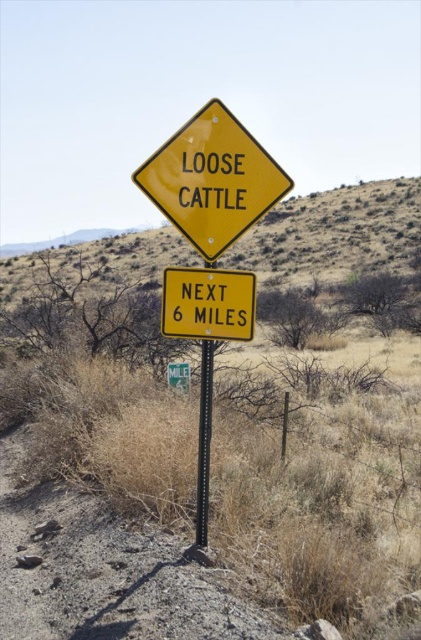
How distant is yellow plastic sign at center from yellow matte diamond at center?

A distance of 57.10 feet exists between yellow plastic sign at center and yellow matte diamond at center.

Between yellow plastic sign at center and yellow matte diamond at center, which one appears on the left side from the viewer's perspective?

Positioned to the left is yellow plastic sign at center.

Is point (183, 456) in front of point (204, 177)?

No, (183, 456) is further to viewer.

You are a GUI agent. You are given a task and a screenshot of the screen. Output one action in this format:
    pyautogui.click(x=<x>, y=<y>)
    Task: Click on the yellow plastic sign at center
    
    Given the screenshot: What is the action you would take?
    pyautogui.click(x=210, y=474)

Is point (282, 188) farther from viewer compared to point (200, 547)?

No, (282, 188) is closer to viewer.

This screenshot has height=640, width=421. What are the coordinates of `yellow matte diamond at center` in the screenshot? It's located at (212, 179).

Does yellow matte sign at center appear on the left side of black metal pole at center?

In fact, yellow matte sign at center is to the right of black metal pole at center.

Is point (183, 301) farther from camera compared to point (197, 532)?

No.

Is point (173, 337) farther from viewer compared to point (207, 387)?

No, (173, 337) is closer to viewer.

Image resolution: width=421 pixels, height=640 pixels. I want to click on yellow matte sign at center, so click(x=207, y=304).